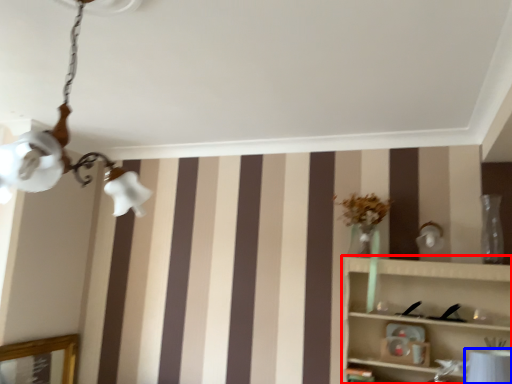
Question: Which point is closer to the camera, shelf (highlighted by a red box) or table lamp (highlighted by a blue box)?

Choices:
 (A) shelf
 (B) table lamp

Answer: (A)